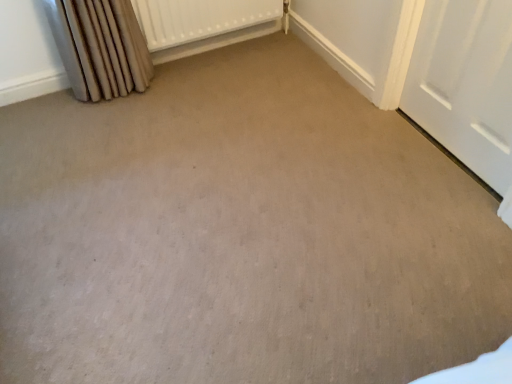
This screenshot has width=512, height=384. Identify the location of free area in between white matte door at right and white textured radiator at upper center. (302, 101).